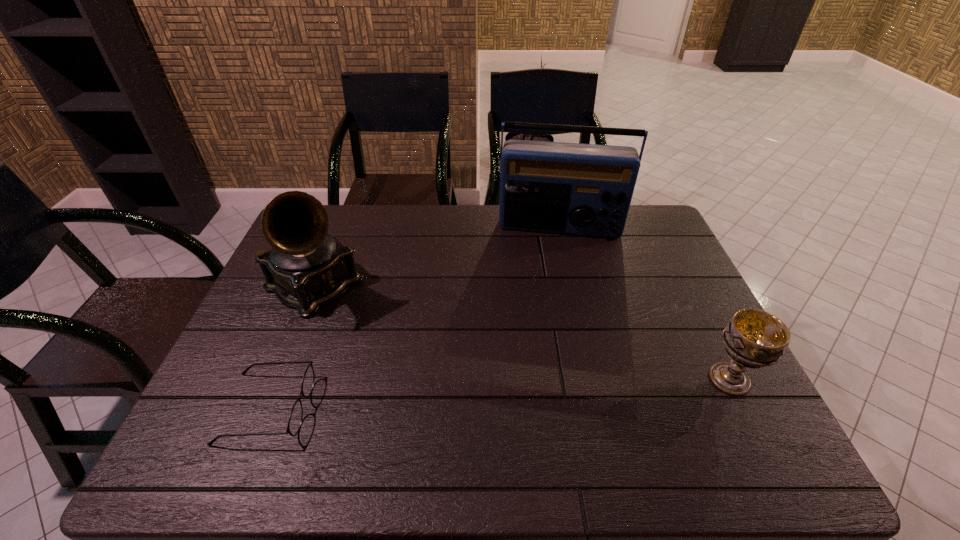
Identify the location of radio receiver present at the right edge. This screenshot has height=540, width=960. (554, 187).

Find the location of a particular element. object at the near left corner is located at coordinates (295, 419).

This screenshot has height=540, width=960. Find the location of `object present at the far right corner`. object present at the far right corner is located at coordinates (554, 187).

Locate an element on the screen. This screenshot has width=960, height=540. object located in the near right corner section of the desktop is located at coordinates (753, 338).

The width and height of the screenshot is (960, 540). In the image, there is a desktop. What are the coordinates of `vacant region at the far edge` in the screenshot? It's located at tap(420, 210).

In the image, there is a desktop. Identify the location of vacant space at the near edge. The height and width of the screenshot is (540, 960). (399, 404).

The image size is (960, 540). I want to click on vacant space at the left edge of the desktop, so click(x=235, y=371).

Locate an element on the screen. The width and height of the screenshot is (960, 540). free space at the right edge is located at coordinates (638, 247).

Identify the location of vacant area at the far right corner. (650, 223).

Image resolution: width=960 pixels, height=540 pixels. In order to click on free space that is in between the third tallest object and the farthest object in this screenshot , I will do `click(645, 303)`.